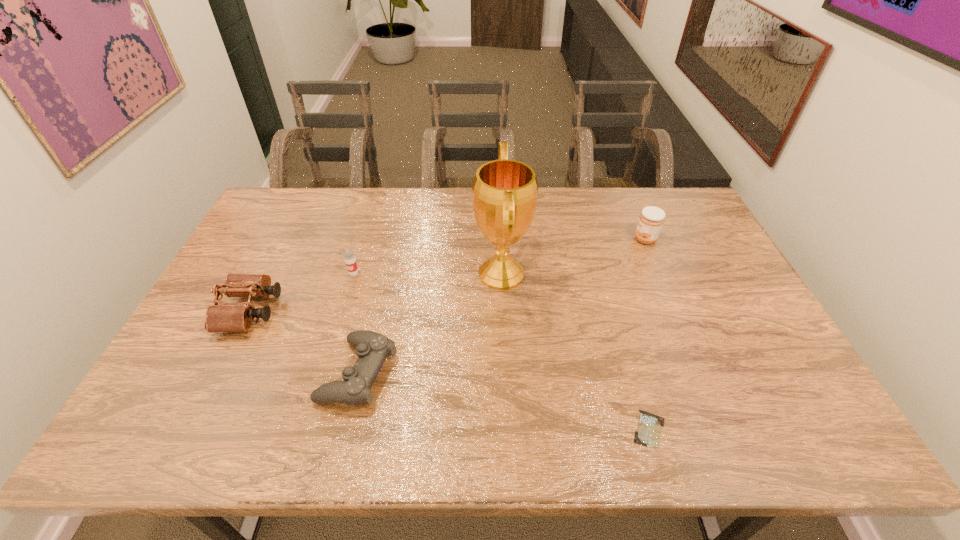
Locate an element on the screen. This screenshot has width=960, height=540. free region that satisfies the following two spatial constraints: 1. on the side of the shortest object with the logo; 2. on the right side of the cup is located at coordinates (307, 429).

This screenshot has height=540, width=960. I want to click on free spot that satisfies the following two spatial constraints: 1. on the front label of the rightmost object; 2. on the side of the cup with the logo, so (660, 273).

Identify the location of vacant region that satisfies the following two spatial constraints: 1. on the back side of the fifth tallest object; 2. through the eyepieces of the binoculars. This screenshot has height=540, width=960. (372, 311).

Identify the location of vacant space that satisfies the following two spatial constraints: 1. on the side of the cup with the logo; 2. through the eyepieces of the binoculars. The image size is (960, 540). (342, 311).